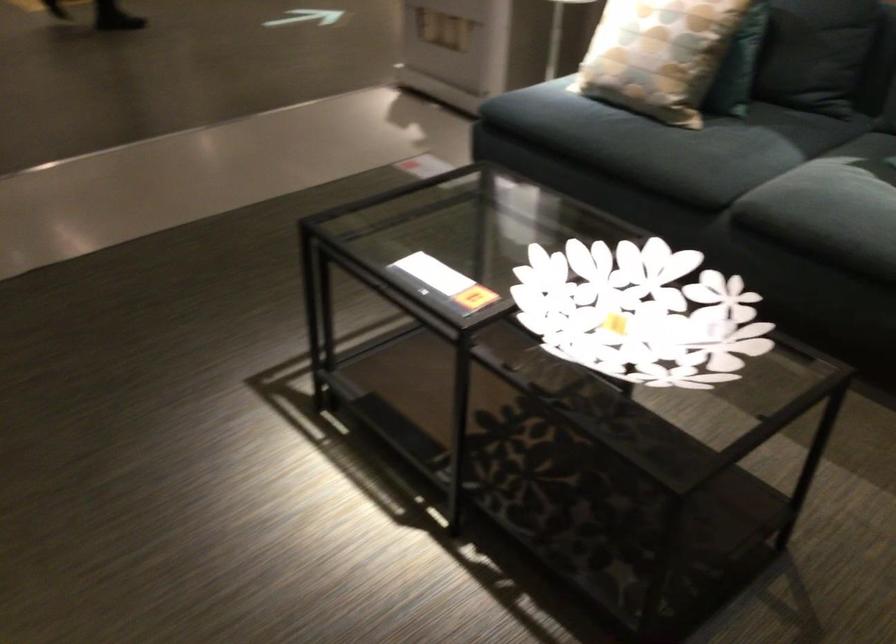
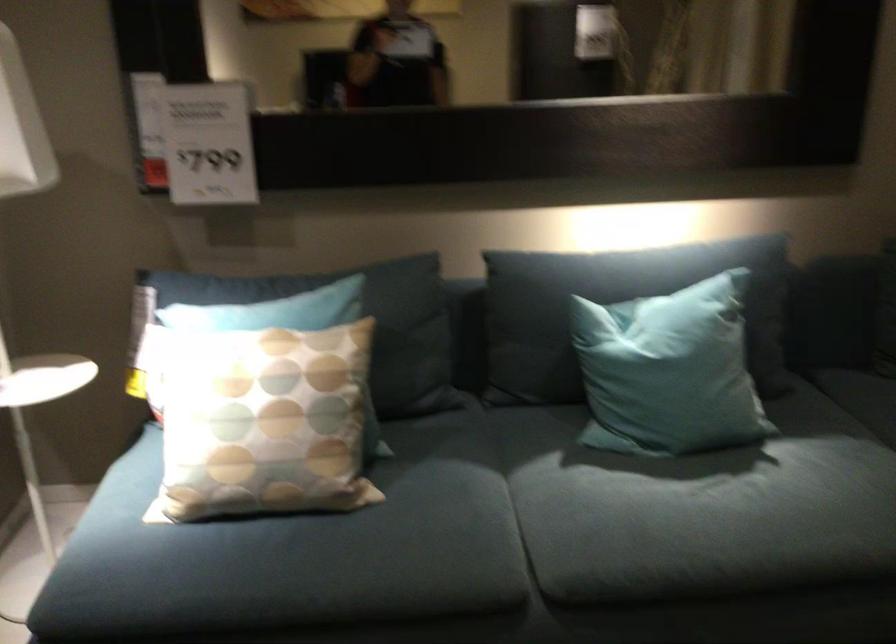
Find the pixel in the second image that matches point (687, 140) in the first image.

(406, 526)